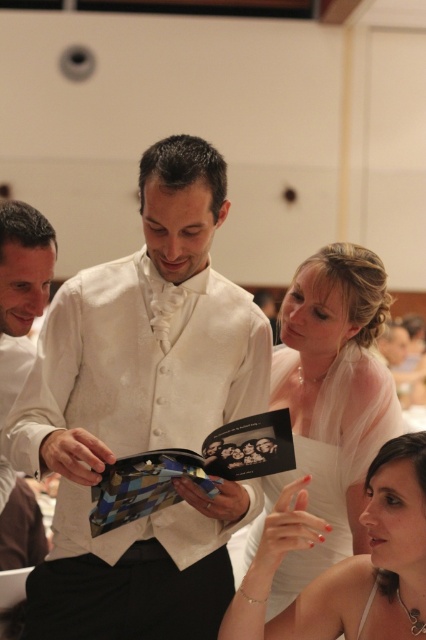
Question: Which of the following is the closest to the observer?

Choices:
 (A) white satin dress at center
 (B) white satin dress at lower right

Answer: (B)

Question: Estimate the real-world distances between objects in this image. Which object is farther from the white satin dress at lower right?

Choices:
 (A) white satin dress at center
 (B) white satin suit at center

Answer: (B)

Question: Among these objects, which one is farthest from the camera?

Choices:
 (A) white satin dress at center
 (B) white satin suit at center
 (C) white satin dress at lower right

Answer: (A)

Question: Can you confirm if white satin suit at center is smaller than white satin dress at lower right?

Choices:
 (A) no
 (B) yes

Answer: (A)

Question: Is white satin dress at center to the left of white satin dress at lower right from the viewer's perspective?

Choices:
 (A) no
 (B) yes

Answer: (B)

Question: Does white satin suit at center appear under white satin dress at lower right?

Choices:
 (A) yes
 (B) no

Answer: (B)